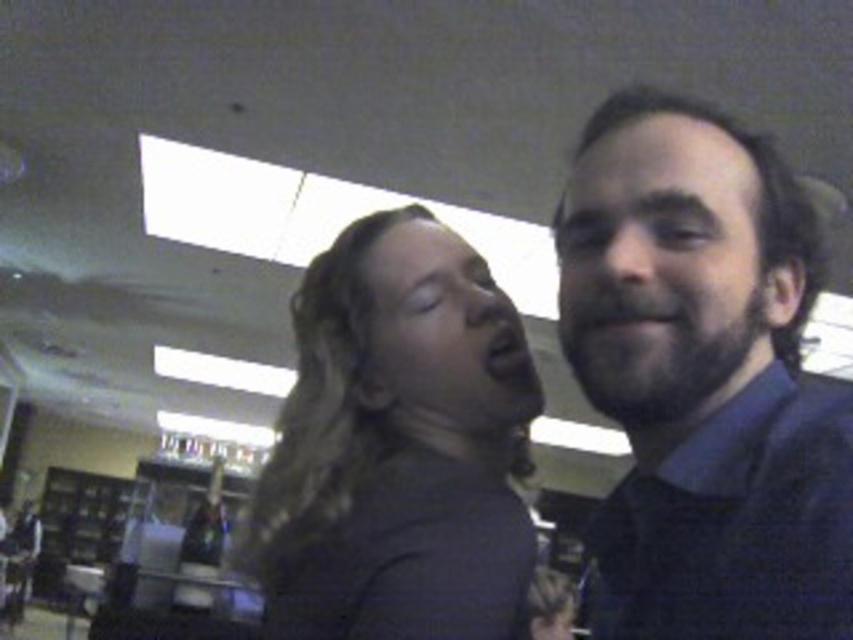
Is dark blue shirt at right positioned behind dark brown hair at center?

No, dark blue shirt at right is in front of dark brown hair at center.

Is dark blue shirt at right bigger than dark brown hair at center?

Actually, dark blue shirt at right might be smaller than dark brown hair at center.

Where is `dark blue shirt at right`? This screenshot has height=640, width=853. dark blue shirt at right is located at coordinates (703, 378).